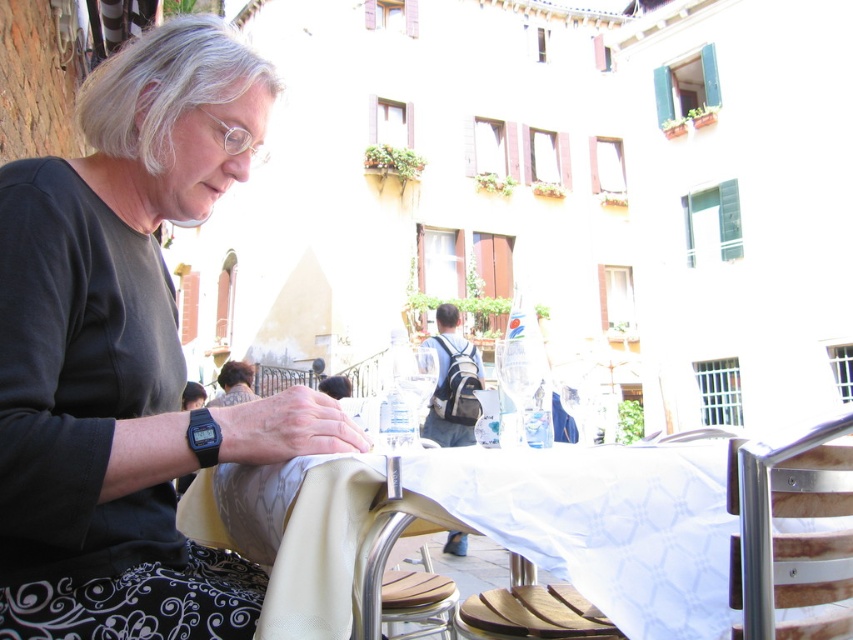
Looking at this image, you are a photographer trying to capture a closeup of the white fabric table at center and the dark brown hair at center. Since you want to focus on both objects equally, which one should you zoom in on more to ensure both are in clear focus?

The white fabric table at center is wider than the dark brown hair at center, so you should zoom in more on the dark brown hair at center to ensure both are in clear focus.

Looking at this image, you are a customer at this outdoor cafe and want to place your bag on the table without it falling off. Considering the size of the white fabric table at center and the satin silver chair at lower center, which surface is more suitable for placing your bag?

The white fabric table at center has a larger size compared to the satin silver chair at lower center, so it is more suitable for placing your bag as it provides more space to prevent it from falling off.